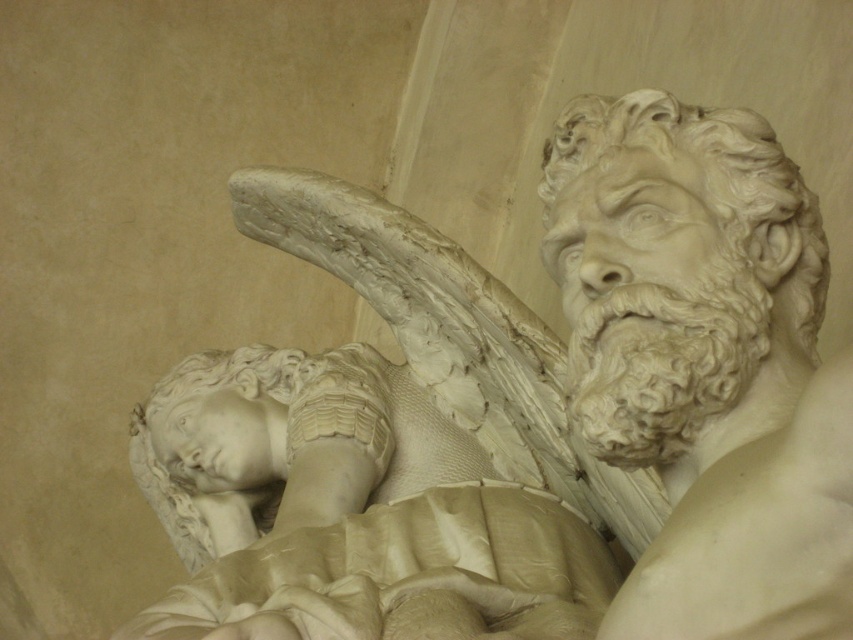
Question: Which object appears farthest from the camera in this image?

Choices:
 (A) white marble head at lower left
 (B) white marble head at upper right

Answer: (A)

Question: Which point is closer to the camera taking this photo?

Choices:
 (A) (653, 340)
 (B) (236, 381)

Answer: (A)

Question: Is white marble head at upper right below white marble head at lower left?

Choices:
 (A) no
 (B) yes

Answer: (A)

Question: Is the position of white marble head at upper right less distant than that of white marble head at lower left?

Choices:
 (A) yes
 (B) no

Answer: (A)

Question: Is white marble head at upper right to the left of white marble head at lower left from the viewer's perspective?

Choices:
 (A) no
 (B) yes

Answer: (A)